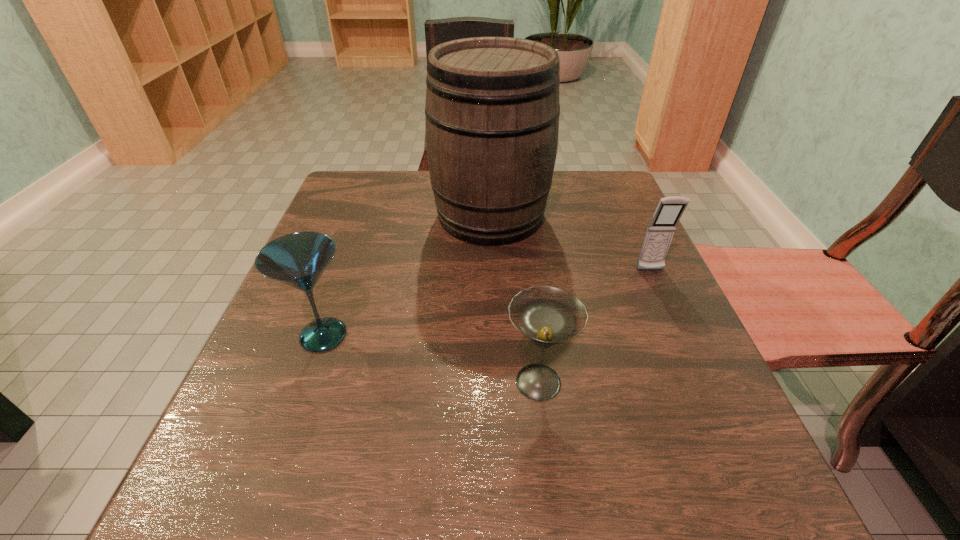
Where is `wine bucket`? The image size is (960, 540). wine bucket is located at coordinates (492, 110).

At what (x,y) coordinates should I click in order to perform the action: click on the farthest object. Please return your answer as a coordinate pair (x, y). The height and width of the screenshot is (540, 960). Looking at the image, I should click on (492, 110).

This screenshot has width=960, height=540. I want to click on the leftmost object, so click(x=298, y=259).

I want to click on the rightmost object, so [x=660, y=231].

What are the coordinates of `cellular telephone` in the screenshot? It's located at (660, 231).

Find the location of a particular element. the right martini is located at coordinates (546, 315).

Find the location of `vacant space located 0.250m on the left of the farthest object`. vacant space located 0.250m on the left of the farthest object is located at coordinates (325, 215).

You are a GUI agent. You are given a task and a screenshot of the screen. Output one action in this format:
    pyautogui.click(x=<x>, y=<y>)
    Task: Click on the vacant space located on the right of the left martini
    The height and width of the screenshot is (540, 960).
    Given the screenshot: What is the action you would take?
    pyautogui.click(x=462, y=335)

Image resolution: width=960 pixels, height=540 pixels. I want to click on free region located 0.340m on the front-facing side of the cellular telephone, so click(723, 431).

Locate an element on the screen. free space located on the front of the right martini is located at coordinates (554, 516).